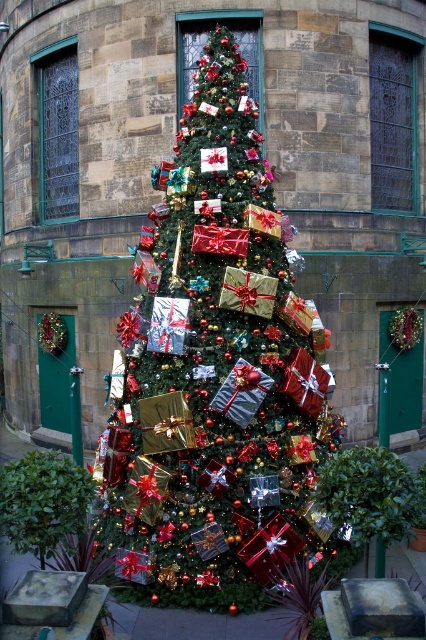
You are standing in front of the festive Christmas tree scene. You want to walk towards the shiny metallic tree at center and the green leafy bush at lower left. Which object will you reach first?

You will reach the shiny metallic tree at center first because it is closer to you than the green leafy bush at lower left, which is further away.

You are standing in front of the Christmas tree and want to place a gift. You need to decide between placing it at point [204,198] or point [19,525]. Which point is closer to you?

Point [19,525] is closer to you because it is in front of point [204,198].

You are a delivery person trying to place a large box that is 1.5 meters wide between the shiny metallic tree at center and the green leafy bush at lower left. Can the box fit in the space between them?

The shiny metallic tree at center and green leafy bush at lower left are 1.61 meters apart. Since the box is 1.5 meters wide, it can fit in the space between them as the distance is slightly larger than the box.